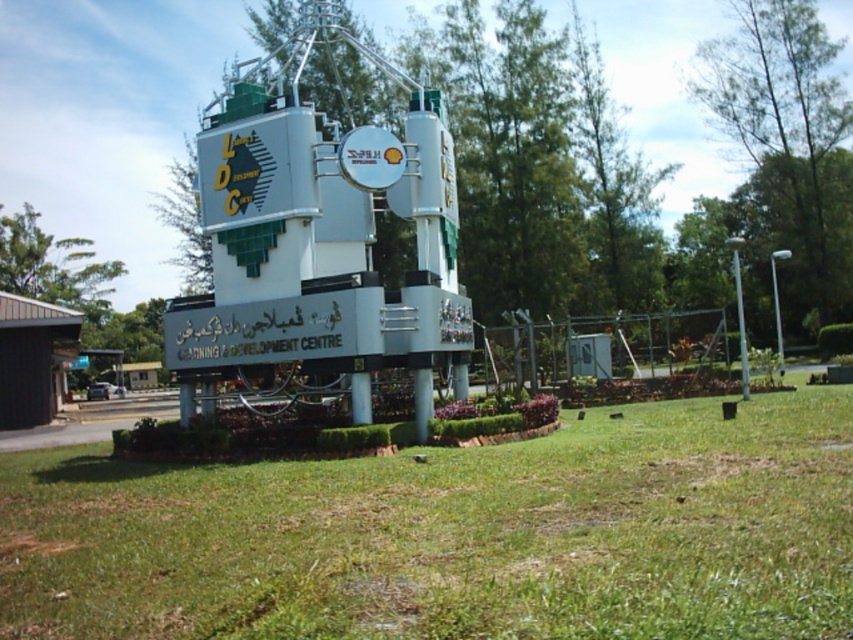
You are standing in front of the LDC structure and want to know if the green grass at center can fit entirely under the white metallic water tower at center. Based on their widths, can it?

The green grass at center is narrower than the white metallic water tower at center, so it can fit entirely under it.

You are standing in front of the LDC structure and see the green grass at center and the white metallic water tower at center. Which object is nearer to you?

The green grass at center is closer to the viewer than the white metallic water tower at center.

You are standing in front of the LDC structure and want to place a small garden decoration between the green grass at center and the white metallic water tower at center. Based on their positions, which object should the decoration be closer to?

The green grass at center is to the right of the white metallic water tower at center, so the decoration should be placed closer to the white metallic water tower at center to be between them.